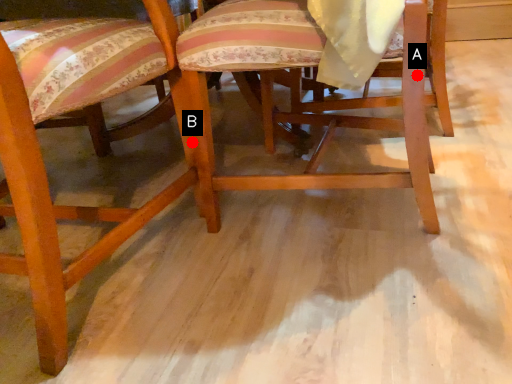
Question: Two points are circled on the image, labeled by A and B beside each circle. Which point is closer to the camera?

Choices:
 (A) A is closer
 (B) B is closer

Answer: (A)